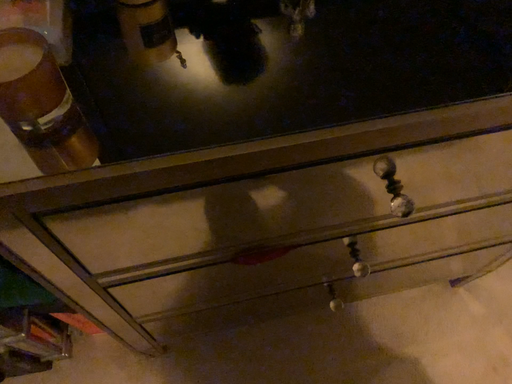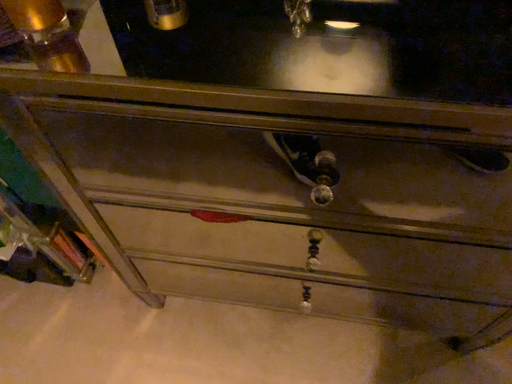
Question: How did the camera likely rotate when shooting the video?

Choices:
 (A) rotated left
 (B) rotated right

Answer: (A)